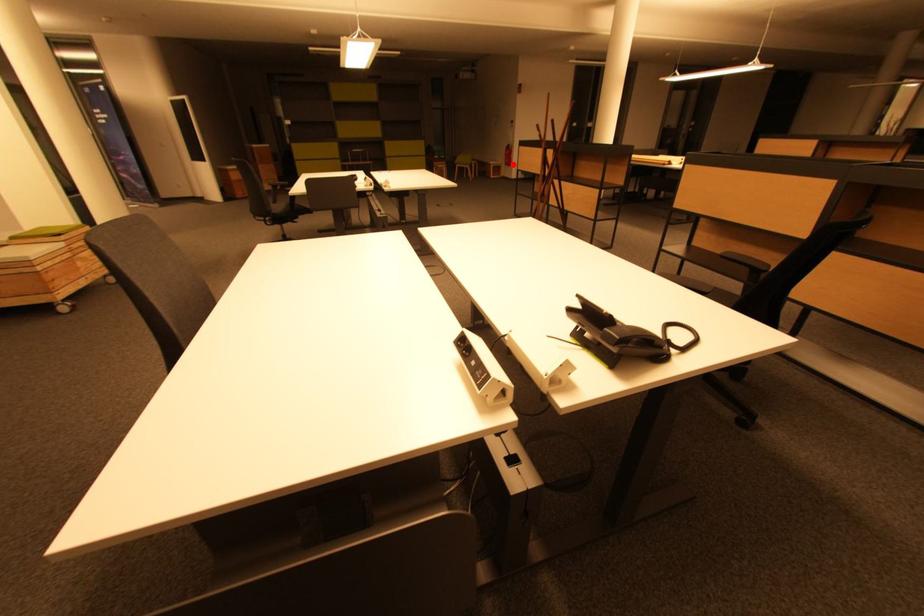
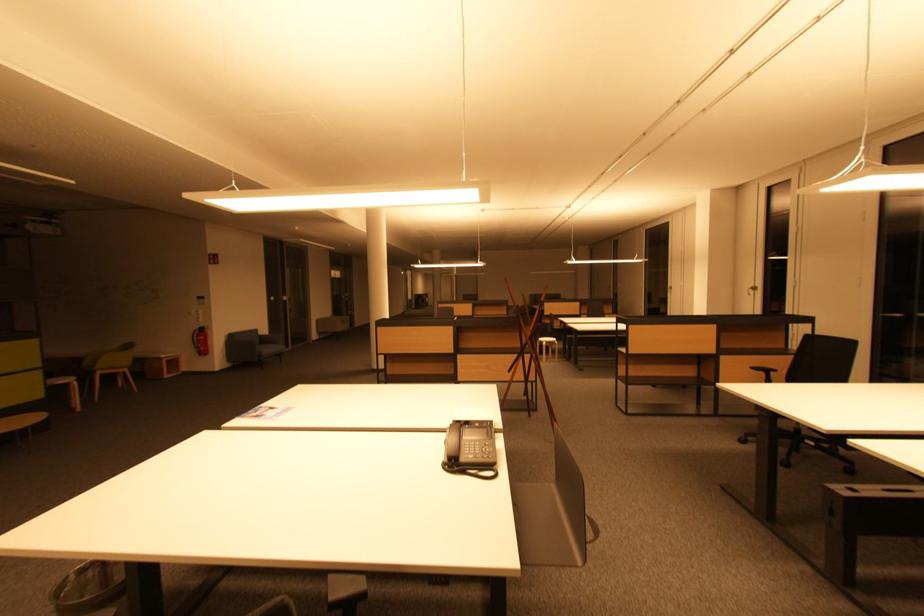
The point at the highlighted location is marked in the first image. Where is the corresponding point in the second image?

(207, 353)